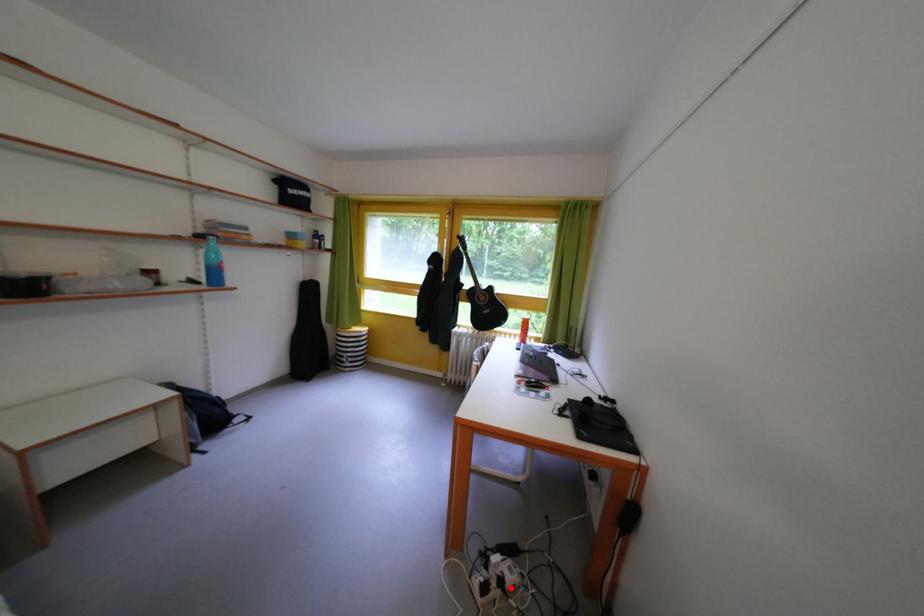
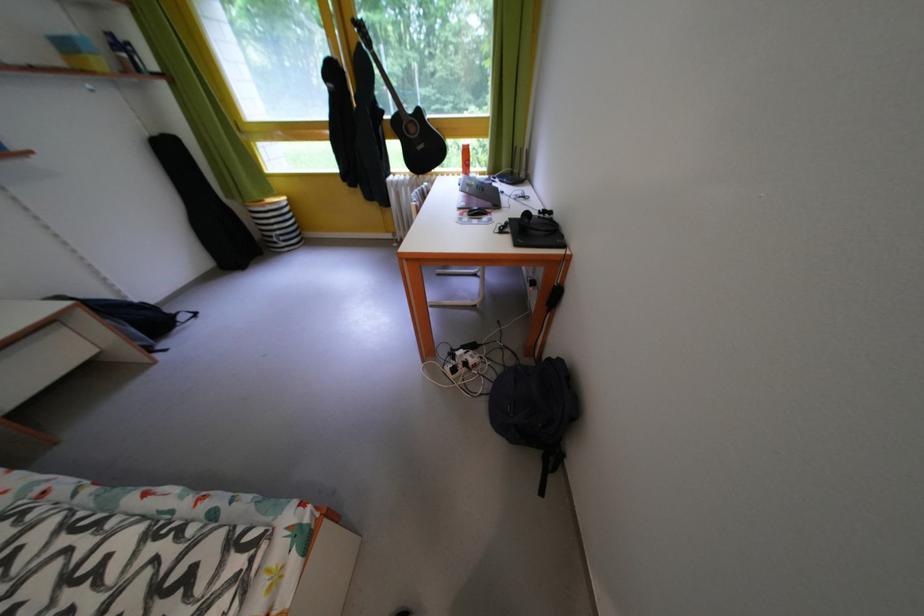
Question: I am providing you with two images of the same scene from different viewpoints. Given a red point in image1, look at the same physical point in image2. Is it:

Choices:
 (A) Closer to the viewpoint
 (B) Farther from the viewpoint

Answer: (B)